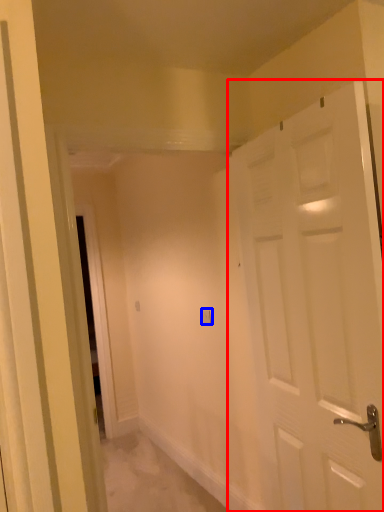
Question: Which object is further to the camera taking this photo, door (highlighted by a red box) or electric outlet (highlighted by a blue box)?

Choices:
 (A) door
 (B) electric outlet

Answer: (B)